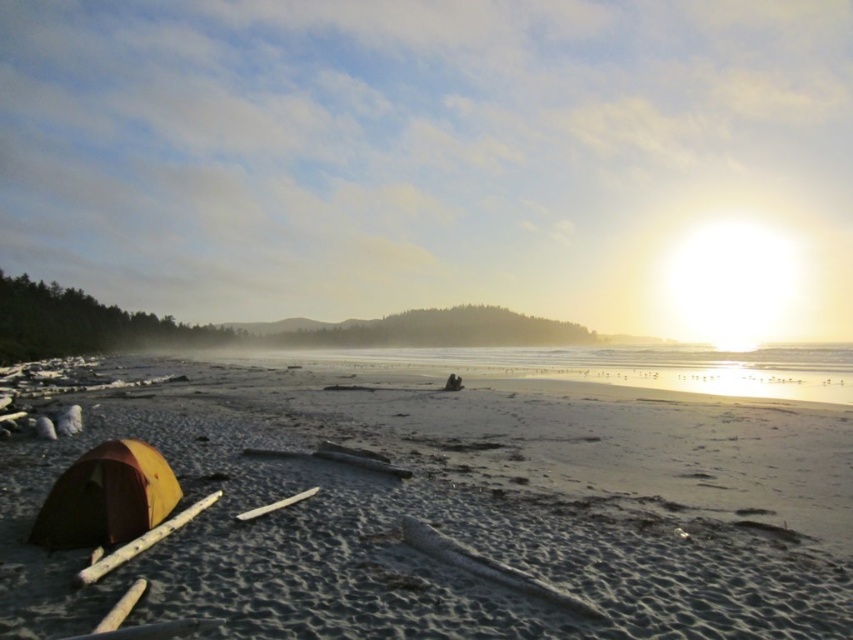
You are standing on the beach and want to set up a small campfire. You have a bag of firewood in your hand. The smooth sand at lower left and the orange fabric tent at lower left are both in your line of sight. Which location would you choose to place the campfire, and why?

You should place the campfire on the smooth sand at lower left because it is closer to you than the orange fabric tent at lower left, making it safer to keep the fire away from the tent.

You are a hiker who wants to set up a tent on the smooth sand at lower left. However, there is already an orange fabric tent at lower left. Can you place your tent next to the existing one without moving it?

The smooth sand at lower left is positioned under orange fabric tent at lower left, so placing another tent next to the existing one might not be possible since the sand area is already occupied by the tent.

You are standing at the point marked as point (457, 506) on the beach. What is the terrain like at that location?

The point (457, 506) corresponds to smooth sand at lower left, so the terrain there is smooth sand.